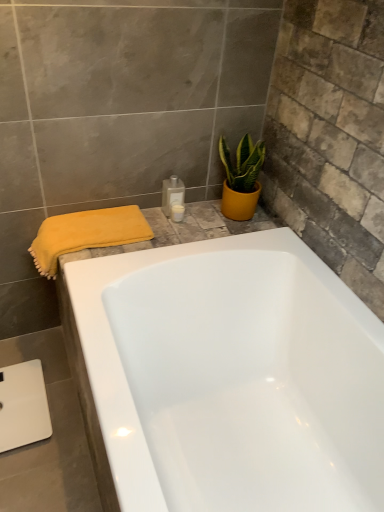
Find the location of a particular element. The height and width of the screenshot is (512, 384). unoccupied region to the right of translucent plastic bottle at upper center, the first toiletry from the top is located at coordinates (210, 221).